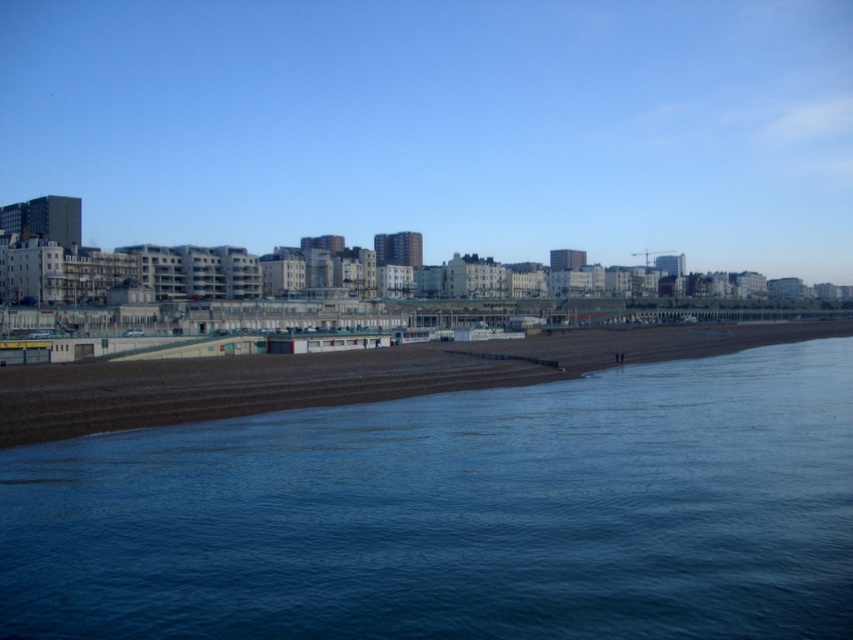
In the scene shown: You are standing on the beach and want to reach the blue water at center. Which direction should you move relative to the brown sand at center?

You should move downward towards the blue water at center since it is located below the brown sand at center.

Based on the photo, you are standing on the beach and see the blue water at center and the brown sand at center. Which one is closer to your right side?

The brown sand at center is closer to your right side because the blue water at center is to the left of brown sand at center.